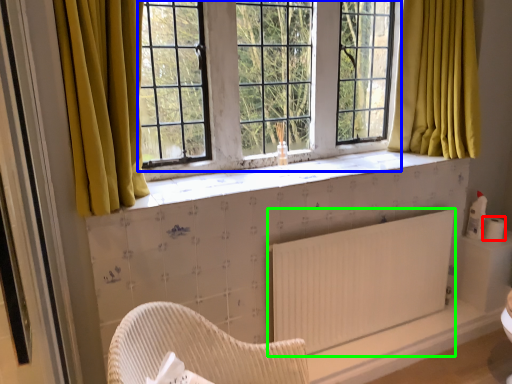
Question: Based on their relative distances, which object is farther from toilet paper (highlighted by a red box)? Choose from window screen (highlighted by a blue box) and radiator (highlighted by a green box).

Choices:
 (A) window screen
 (B) radiator

Answer: (A)